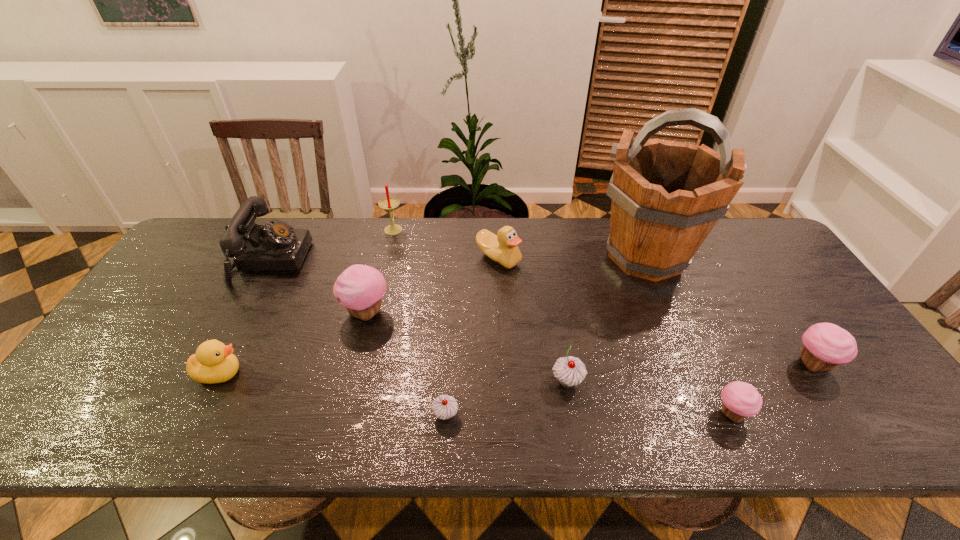
What are the coordinates of `free spot between the yellow duckling and the nearest pink cupcake` in the screenshot? It's located at (476, 393).

The width and height of the screenshot is (960, 540). I want to click on empty space between the second biggest pink cupcake and the candle, so click(603, 296).

Find the location of `vacant area that lies between the nearest pink cupcake and the yellow duckling`. vacant area that lies between the nearest pink cupcake and the yellow duckling is located at coordinates (476, 393).

Image resolution: width=960 pixels, height=540 pixels. What are the coordinates of `the fourth closest object to the telephone` in the screenshot? It's located at (503, 248).

You are a GUI agent. You are given a task and a screenshot of the screen. Output one action in this format:
    pyautogui.click(x=<x>, y=<y>)
    Task: Click on the object that is the third closest one to the smallest pink cupcake
    The width and height of the screenshot is (960, 540).
    Given the screenshot: What is the action you would take?
    click(667, 196)

Locate an element on the screen. cupcake object that ranks as the third closest to the black telephone is located at coordinates (570, 371).

Where is `the fifth closest cupcake to the duck`? This screenshot has height=540, width=960. the fifth closest cupcake to the duck is located at coordinates (825, 345).

I want to click on pink cupcake that stands as the second closest to the telephone, so click(x=740, y=400).

Locate which pink cupcake is the closest to the left gray cupcake. Please provide its 2D coordinates. Your answer should be formatted as a tuple, i.e. [(x, y)], where the tuple contains the x and y coordinates of a point satisfying the conditions above.

[(360, 288)]

Find the location of `vacant region that satisfies the following two spatial constraints: 1. at the beak of the second pink cupcake from right to left; 2. on the right side of the fifth object from right to left`. vacant region that satisfies the following two spatial constraints: 1. at the beak of the second pink cupcake from right to left; 2. on the right side of the fifth object from right to left is located at coordinates (506, 414).